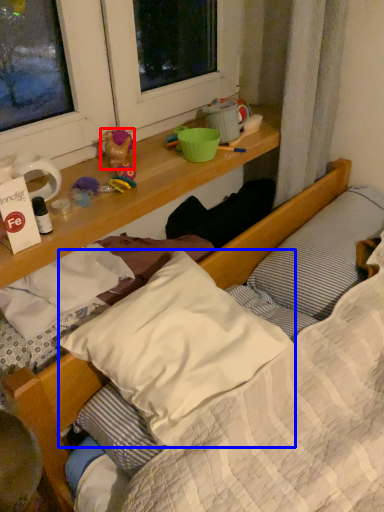
Question: Which point is further to the camera, toy (highlighted by a red box) or pillow (highlighted by a blue box)?

Choices:
 (A) toy
 (B) pillow

Answer: (A)